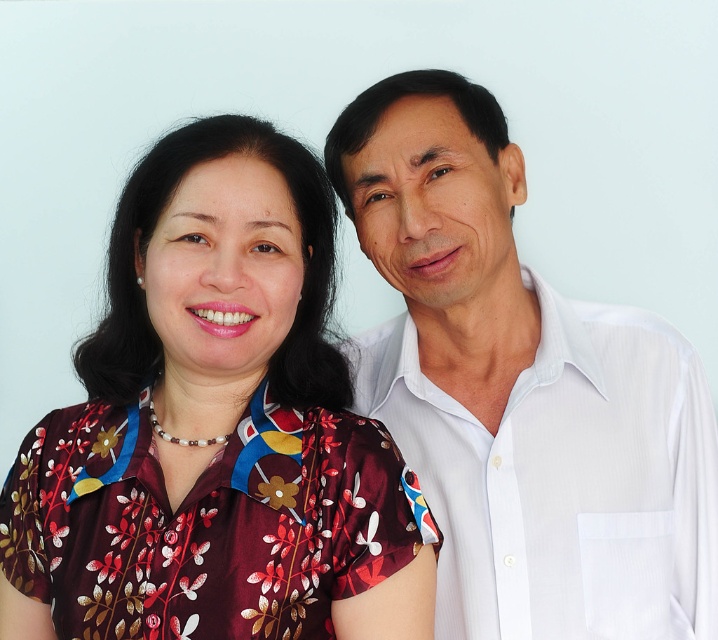
Question: Which point is farther to the camera?

Choices:
 (A) (480, 252)
 (B) (321, 364)

Answer: (A)

Question: Considering the relative positions of floral silk blouse at center and white smooth shirt at right in the image provided, where is floral silk blouse at center located with respect to white smooth shirt at right?

Choices:
 (A) left
 (B) right

Answer: (A)

Question: Does floral silk blouse at center have a smaller size compared to white smooth shirt at right?

Choices:
 (A) no
 (B) yes

Answer: (B)

Question: Which object is closer to the camera taking this photo?

Choices:
 (A) floral silk blouse at center
 (B) white smooth shirt at right

Answer: (A)

Question: Is floral silk blouse at center thinner than white smooth shirt at right?

Choices:
 (A) no
 (B) yes

Answer: (A)